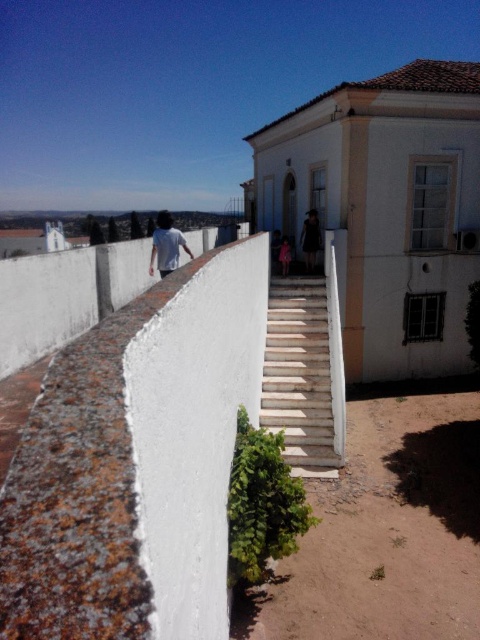
Is white cotton shirt at center positioned in front of pink fabric dress at center?

That is True.

Where is `white cotton shirt at center`? The width and height of the screenshot is (480, 640). white cotton shirt at center is located at coordinates (167, 244).

Does white cotton shirt at center have a lesser width compared to black fabric dress at center?

Incorrect, white cotton shirt at center's width is not less than black fabric dress at center's.

Is point (154, 237) farther from viewer compared to point (312, 220)?

No.

Locate an element on the screen. The height and width of the screenshot is (640, 480). white cotton shirt at center is located at coordinates (167, 244).

Find the location of a particular element. The width and height of the screenshot is (480, 640). white cotton shirt at center is located at coordinates (x=167, y=244).

Which is in front, point (338, 458) or point (314, 216)?

Point (338, 458)

The height and width of the screenshot is (640, 480). What are the coordinates of `white concrete stairs at center` in the screenshot? It's located at (301, 378).

Is point (283, 326) closer to viewer compared to point (313, 230)?

Yes, it is.

At what (x,y) coordinates should I click in order to perform the action: click on white concrete stairs at center. Please return your answer as a coordinate pair (x, y). Looking at the image, I should click on (301, 378).